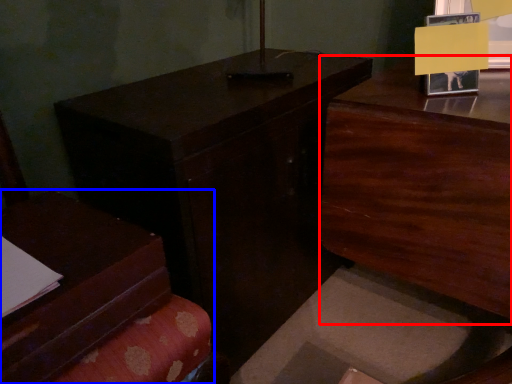
Question: Which object appears farthest to the camera in this image, dresser (highlighted by a red box) or furniture (highlighted by a blue box)?

Choices:
 (A) dresser
 (B) furniture

Answer: (A)